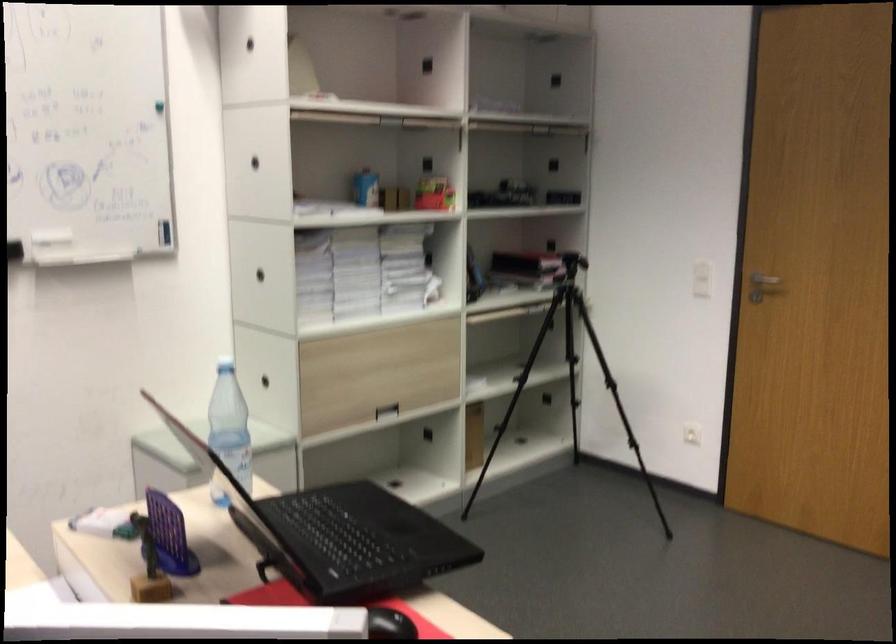
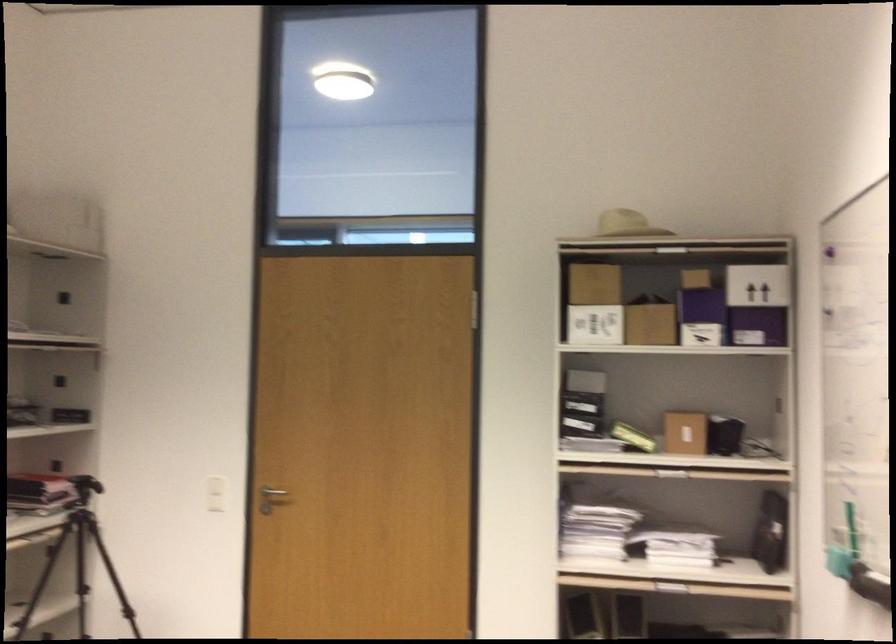
Where in the second image is the point corresponding to [709,278] from the first image?

(216, 494)